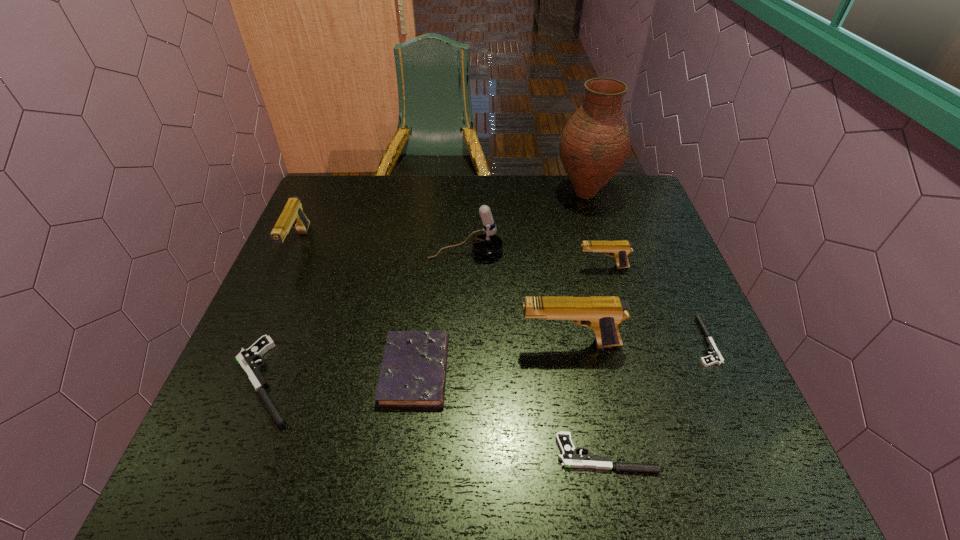
Where is `vacant space located 0.230m at the barrel of the biggest tan pistol`? The width and height of the screenshot is (960, 540). vacant space located 0.230m at the barrel of the biggest tan pistol is located at coordinates (416, 343).

Where is `vacant space situated at the barrel of the fifth shortest pistol`? The height and width of the screenshot is (540, 960). vacant space situated at the barrel of the fifth shortest pistol is located at coordinates (276, 293).

Identify the location of vacant area located at the barrel of the smallest tan pistol. The image size is (960, 540). (470, 267).

Where is `vacant area located 0.250m at the barrel of the smallest tan pistol`? This screenshot has height=540, width=960. vacant area located 0.250m at the barrel of the smallest tan pistol is located at coordinates (481, 267).

The width and height of the screenshot is (960, 540). I want to click on vacant space located 0.370m at the barrel of the smallest tan pistol, so click(x=436, y=267).

Locate an element on the screen. The width and height of the screenshot is (960, 540). free space located 0.240m on the left of the sixth tallest object is located at coordinates pyautogui.click(x=270, y=370).

Find the location of a particular element. vacant area located 0.190m on the front-facing side of the nearest black pistol is located at coordinates (453, 454).

The width and height of the screenshot is (960, 540). I want to click on blank area located on the front-facing side of the nearest black pistol, so pos(453,454).

This screenshot has height=540, width=960. Find the location of `free space located on the front-facing side of the nearest black pistol`. free space located on the front-facing side of the nearest black pistol is located at coordinates (344, 454).

Find the location of `free space located 0.060m on the front-facing side of the rightmost black pistol`. free space located 0.060m on the front-facing side of the rightmost black pistol is located at coordinates point(665,341).